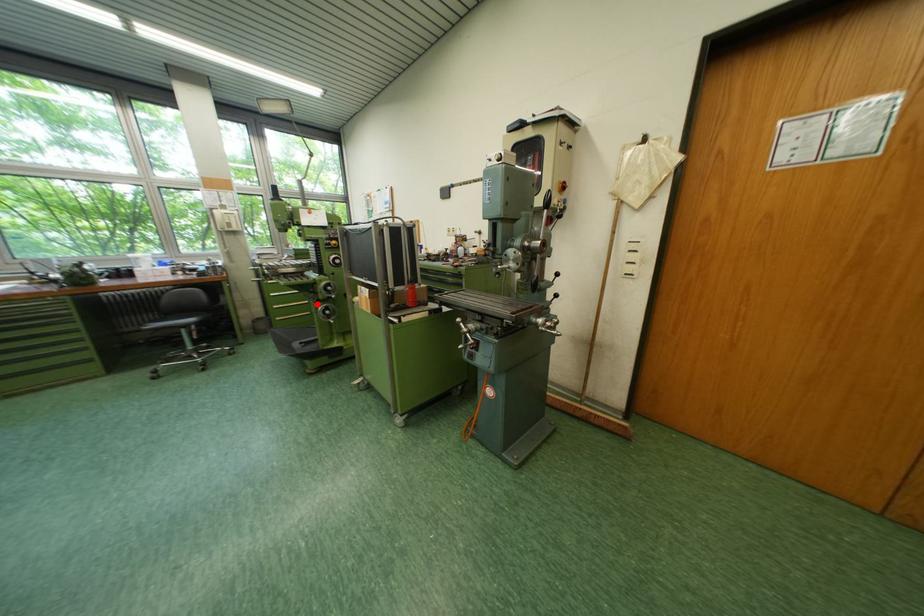
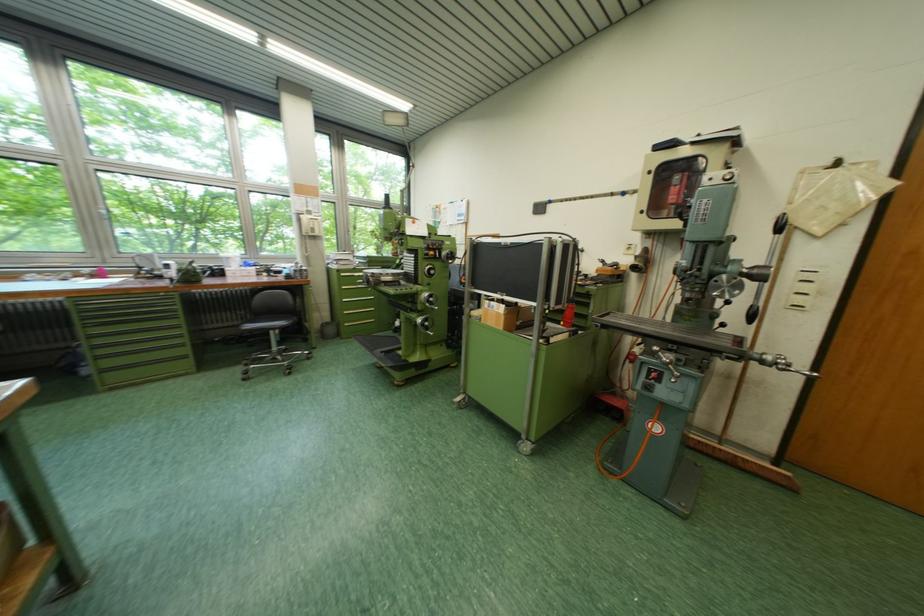
Find the pixel in the second image that matches the highlighted location in the first image.

(383, 312)